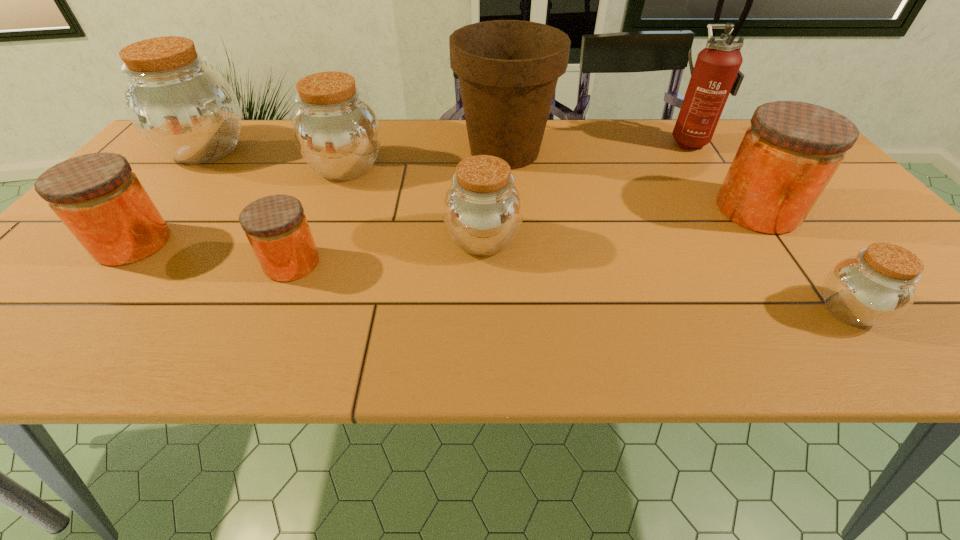
This screenshot has width=960, height=540. Identify the location of the nearest object. (878, 285).

You are a GUI agent. You are given a task and a screenshot of the screen. Output one action in this format:
    pyautogui.click(x=<x>, y=<y>)
    Task: Click on the nearest jar
    The image size is (960, 540).
    Given the screenshot: What is the action you would take?
    pos(878,285)

Where is `vacant space located 0.330m at the nozzle of the tallest object`? This screenshot has height=540, width=960. vacant space located 0.330m at the nozzle of the tallest object is located at coordinates (553, 140).

I want to click on blank space located at the nozzle of the tallest object, so click(612, 140).

Where is `vacant space located at the nozzle of the tallest object`? This screenshot has height=540, width=960. vacant space located at the nozzle of the tallest object is located at coordinates (626, 140).

Where is `free space located 0.160m on the front of the flowerpot`? free space located 0.160m on the front of the flowerpot is located at coordinates (510, 219).

Locate an element on the screen. The width and height of the screenshot is (960, 540). free spot located on the front of the leftmost brown jar is located at coordinates (147, 220).

Find the location of `free point located on the right of the second brown jar from left to right`. free point located on the right of the second brown jar from left to right is located at coordinates (465, 167).

At what (x,y) coordinates should I click in order to perform the action: click on blank space located on the back of the biggest orange jar. Please return your answer as a coordinate pair (x, y). Looking at the image, I should click on (707, 139).

Identify the location of vacant space located 0.220m on the back of the second smallest orange jar. The height and width of the screenshot is (540, 960). point(194,169).